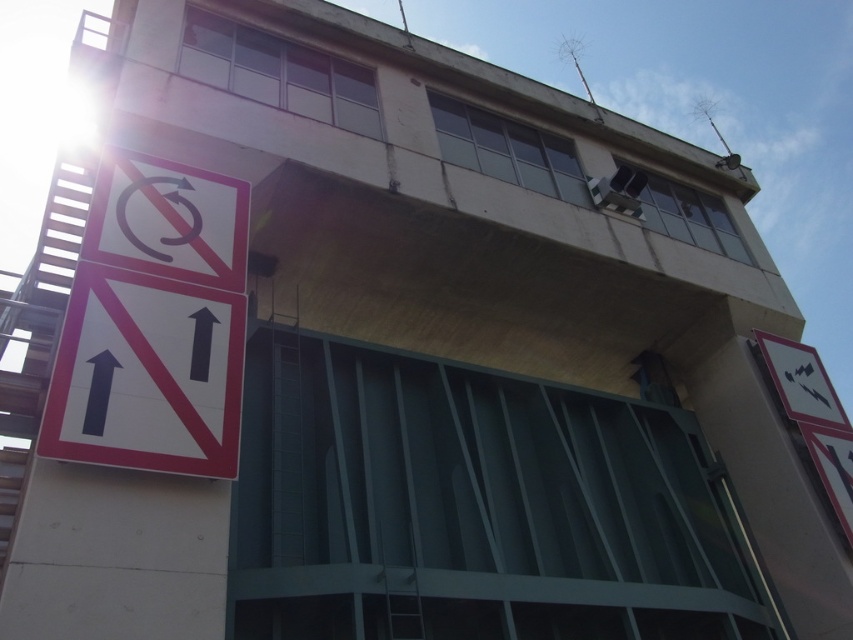
Question: Is white matte sign at left below white plastic sign at left?

Choices:
 (A) yes
 (B) no

Answer: (A)

Question: Can you confirm if white matte sign at left is bigger than white plastic sign at left?

Choices:
 (A) no
 (B) yes

Answer: (B)

Question: Can you confirm if white matte sign at left is bigger than white plastic sign at left?

Choices:
 (A) yes
 (B) no

Answer: (A)